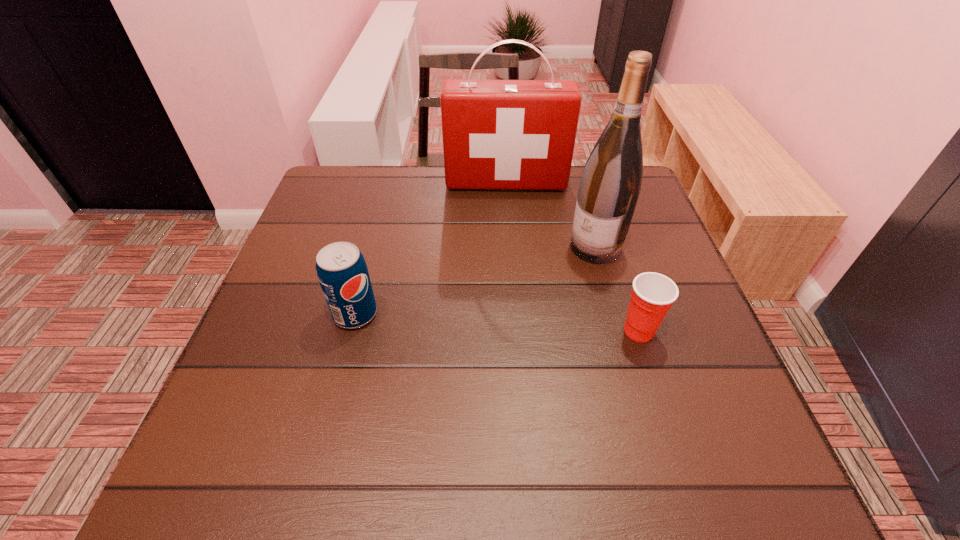
You are a GUI agent. You are given a task and a screenshot of the screen. Output one action in this format:
    pyautogui.click(x=<x>, y=<y>)
    Task: Click on the vacant region located 0.310m on the label of the wine bottle
    Image resolution: width=960 pixels, height=540 pixels.
    Given the screenshot: What is the action you would take?
    pyautogui.click(x=486, y=334)

You are a GUI agent. You are given a task and a screenshot of the screen. Output one action in this format:
    pyautogui.click(x=<x>, y=<y>)
    Task: Click on the free space located 0.310m on the front face of the farthest object
    
    Given the screenshot: What is the action you would take?
    pyautogui.click(x=509, y=272)

Locate an element on the screen. vacant space located 0.230m on the front face of the farthest object is located at coordinates [x=508, y=248].

The image size is (960, 540). I want to click on vacant region located on the front face of the farthest object, so click(x=508, y=243).

Find the location of `object positioned at the far edge`. object positioned at the far edge is located at coordinates (497, 134).

You are a GUI agent. You are given a task and a screenshot of the screen. Output one action in this format:
    pyautogui.click(x=<x>, y=<y>)
    Task: Click on the object positioned at the left edge
    The width and height of the screenshot is (960, 540).
    Given the screenshot: What is the action you would take?
    pyautogui.click(x=342, y=272)

Where is `Dixie cup that is at the right edge`? The image size is (960, 540). Dixie cup that is at the right edge is located at coordinates (653, 294).

You are a GUI agent. You are given a task and a screenshot of the screen. Output one action in this format:
    pyautogui.click(x=<x>, y=<y>)
    Task: Click on the wine bottle that is at the right edge
    This screenshot has width=960, height=540.
    Given the screenshot: What is the action you would take?
    pyautogui.click(x=610, y=185)

I want to click on free space at the far edge, so click(438, 207).

Locate an element on the screen. This screenshot has height=540, width=960. vacant space at the near edge of the desktop is located at coordinates (571, 397).